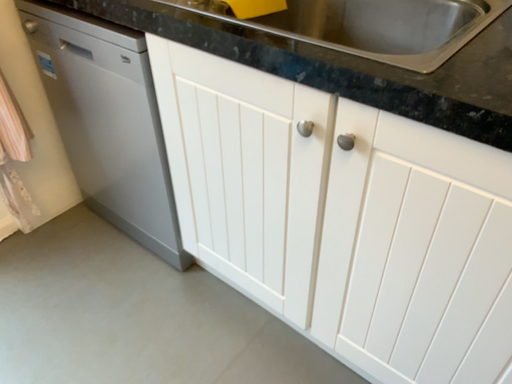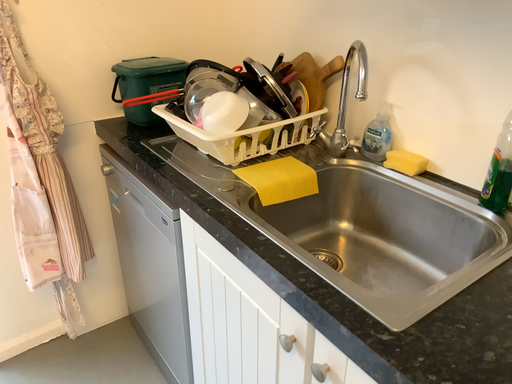
Question: Which way did the camera rotate in the video?

Choices:
 (A) rotated downward
 (B) rotated upward

Answer: (B)